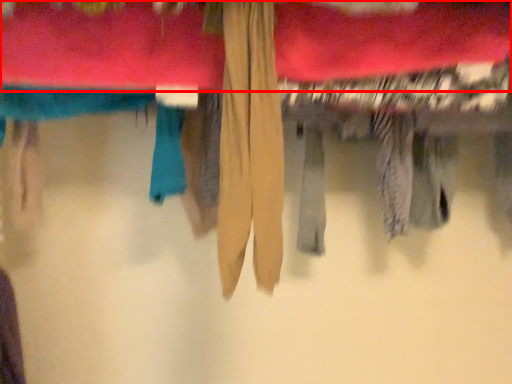
Question: Observing the image, what is the correct spatial positioning of towel (annotated by the red box) in reference to clothing?

Choices:
 (A) right
 (B) left

Answer: (A)